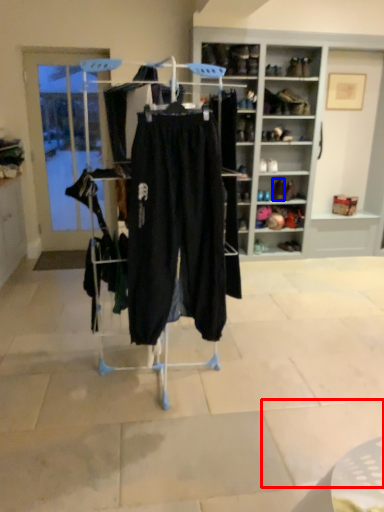
Question: Which point is further to the camera, tile (highlighted by a red box) or footwear (highlighted by a blue box)?

Choices:
 (A) tile
 (B) footwear

Answer: (B)